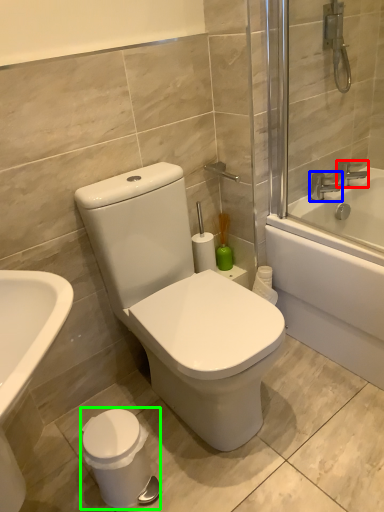
Question: Which object is positioned closest to tap (highlighted by a red box)? Select from tap (highlighted by a blue box) and porcelain (highlighted by a green box).

Choices:
 (A) tap
 (B) porcelain

Answer: (A)